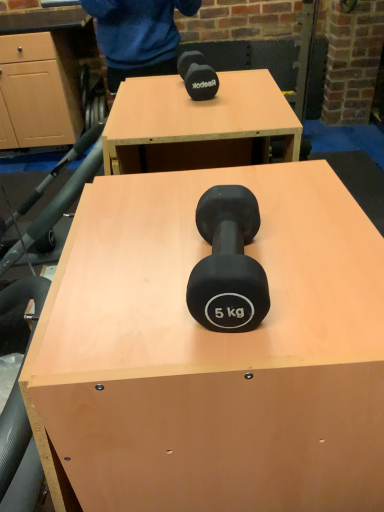
The width and height of the screenshot is (384, 512). I want to click on empty space that is ontop of matte black dumbbell at center (from a real-world perspective), so click(x=191, y=251).